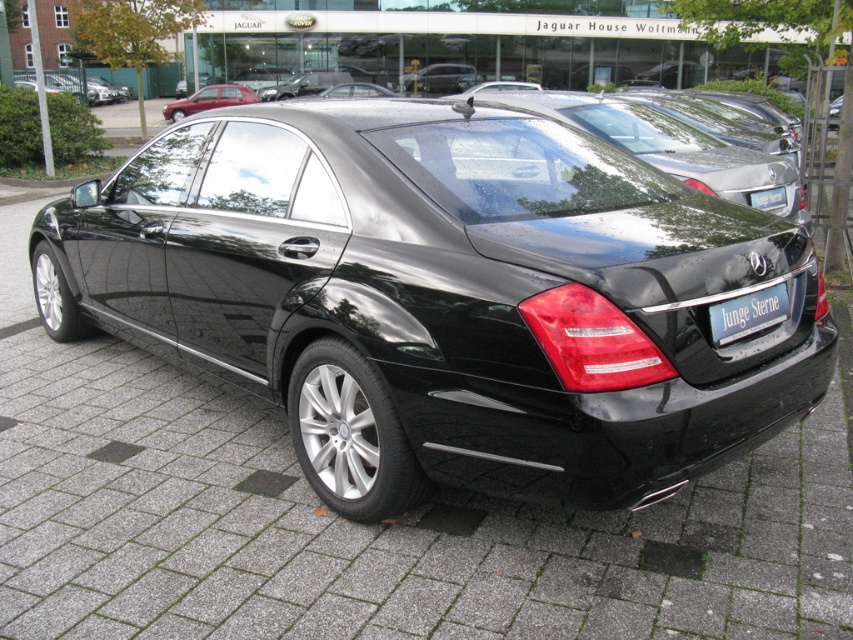
Which is in front, point (198, 161) or point (750, 330)?

Positioned in front is point (750, 330).

Is black metallic car at center taller than black metallic license plate at rear?

Indeed, black metallic car at center has a greater height compared to black metallic license plate at rear.

This screenshot has width=853, height=640. I want to click on black metallic car at center, so click(x=445, y=298).

Is black metallic car at center to the left of blue metallic license plate at center from the viewer's perspective?

Yes, black metallic car at center is to the left of blue metallic license plate at center.

Is the position of black metallic car at center more distant than that of blue metallic license plate at center?

That is False.

I want to click on black metallic car at center, so [x=445, y=298].

Can you confirm if black metallic license plate at rear is positioned below matte red sedan at upper left?

Yes.

Between point (744, 307) and point (178, 108), which one is positioned in front?

Positioned in front is point (744, 307).

Who is more distant from viewer, (x=732, y=333) or (x=192, y=99)?

Positioned behind is point (x=192, y=99).

The image size is (853, 640). In order to click on black metallic license plate at rear in this screenshot , I will do `click(747, 314)`.